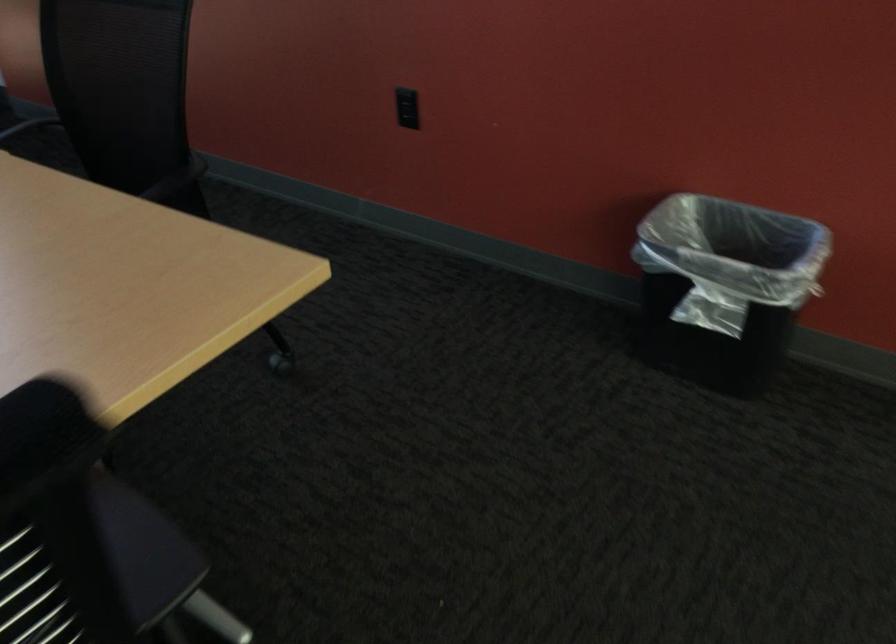
I want to click on black electrical outlet, so click(407, 102).